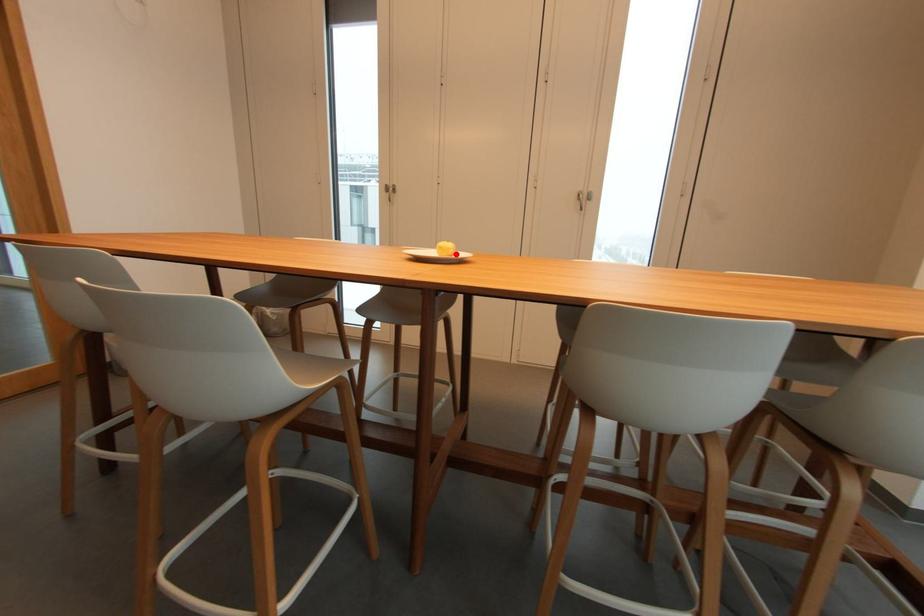
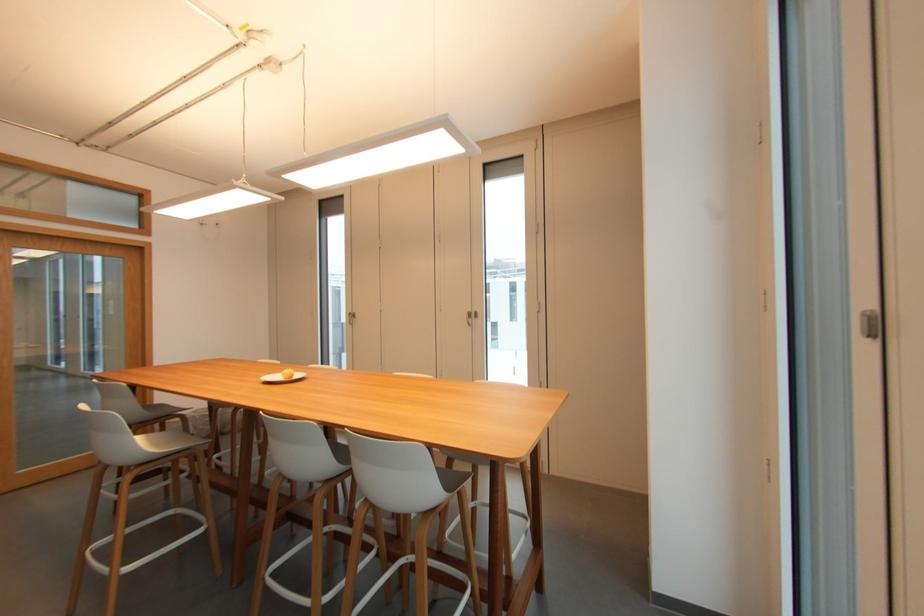
Locate, in the second image, the point that corresponds to the highlighted location in the first image.

(296, 377)